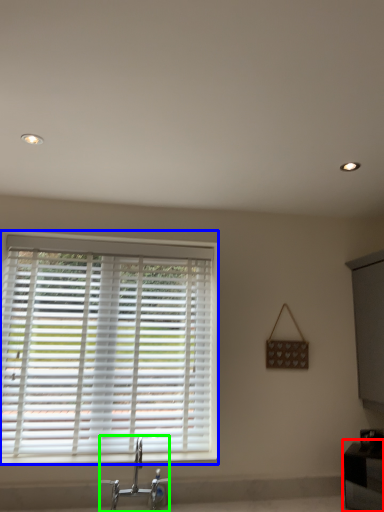
Question: Estimate the real-world distances between objects in this image. Which object is closer to vanity (highlighted by a red box), window blind (highlighted by a blue box) or tap (highlighted by a green box)?

Choices:
 (A) window blind
 (B) tap

Answer: (B)